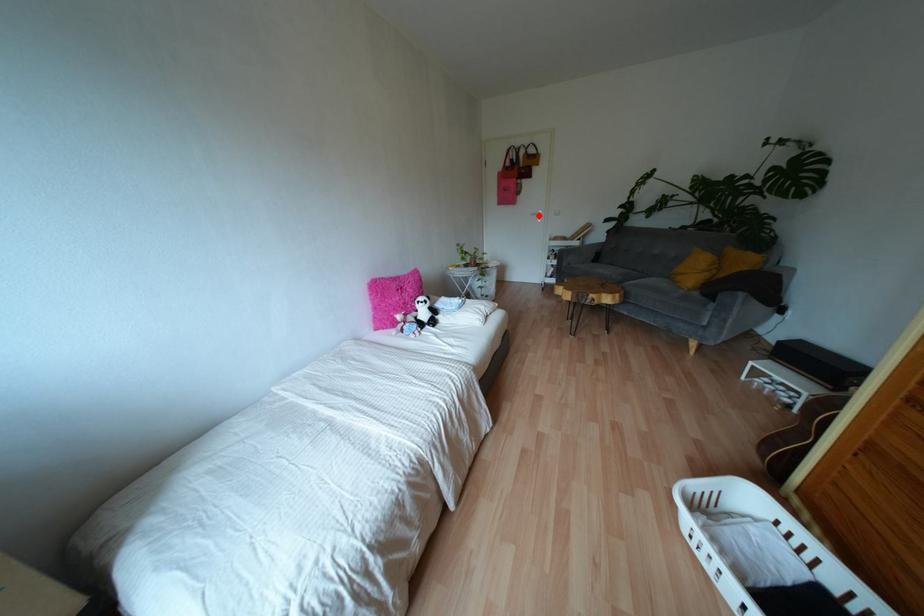
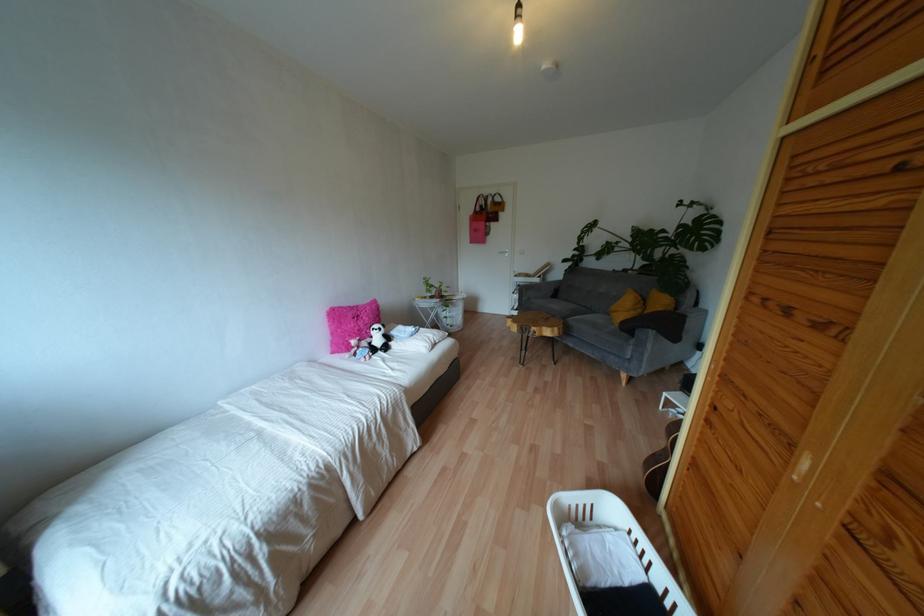
In the second image, find the point that corresponds to the highlighted location in the first image.

(505, 254)